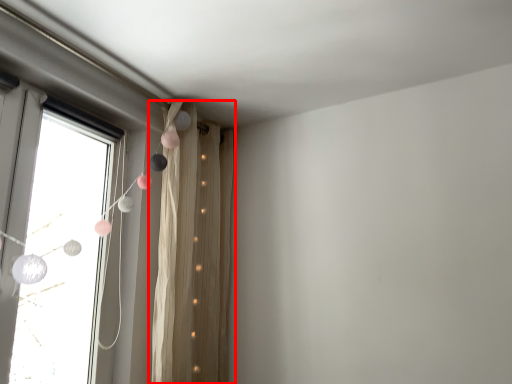
Question: Considering the relative positions of curtain (annotated by the red box) and window in the image provided, where is curtain (annotated by the red box) located with respect to the staircase?

Choices:
 (A) left
 (B) right

Answer: (B)